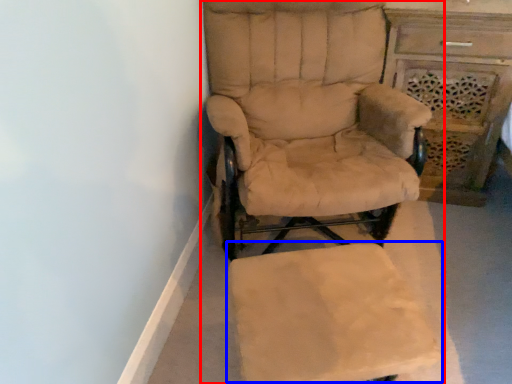
Question: Among these objects, which one is nearest to the camera, chair (highlighted by a red box) or swivel chair (highlighted by a blue box)?

Choices:
 (A) chair
 (B) swivel chair

Answer: (B)